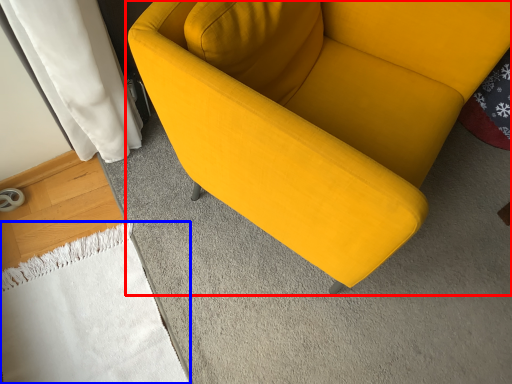
Question: Which object is closer to the camera taking this photo, studio couch (highlighted by a red box) or blanket (highlighted by a blue box)?

Choices:
 (A) studio couch
 (B) blanket

Answer: (A)